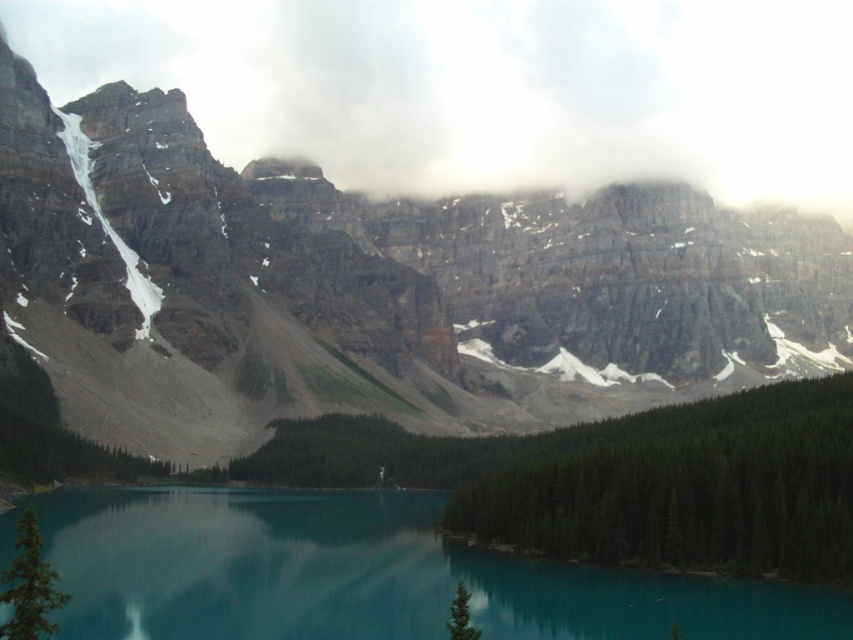
Which of these two, rocky cliff at center or teal glassy water at center, stands taller?

rocky cliff at center is taller.

You are a GUI agent. You are given a task and a screenshot of the screen. Output one action in this format:
    pyautogui.click(x=<x>, y=<y>)
    Task: Click on the rocky cliff at center
    
    Given the screenshot: What is the action you would take?
    pyautogui.click(x=372, y=289)

Does point (175, 93) come closer to viewer compared to point (4, 528)?

No.

Identify the location of rocky cliff at center. (372, 289).

Which of these two, rocky cliff at center or white fluffy cloud at upper center, stands shorter?

With less height is white fluffy cloud at upper center.

I want to click on rocky cliff at center, so click(372, 289).

You are a GUI agent. You are given a task and a screenshot of the screen. Output one action in this format:
    pyautogui.click(x=<x>, y=<y>)
    Task: Click on the rocky cliff at center
    The width and height of the screenshot is (853, 640).
    Given the screenshot: What is the action you would take?
    pyautogui.click(x=372, y=289)

Is white fluffy cloud at upper center closer to the viewer compared to teal glassy water at center?

That is False.

Identify the location of white fluffy cloud at upper center. The height and width of the screenshot is (640, 853). point(486,88).

Image resolution: width=853 pixels, height=640 pixels. In order to click on white fluffy cloud at upper center in this screenshot , I will do `click(486, 88)`.